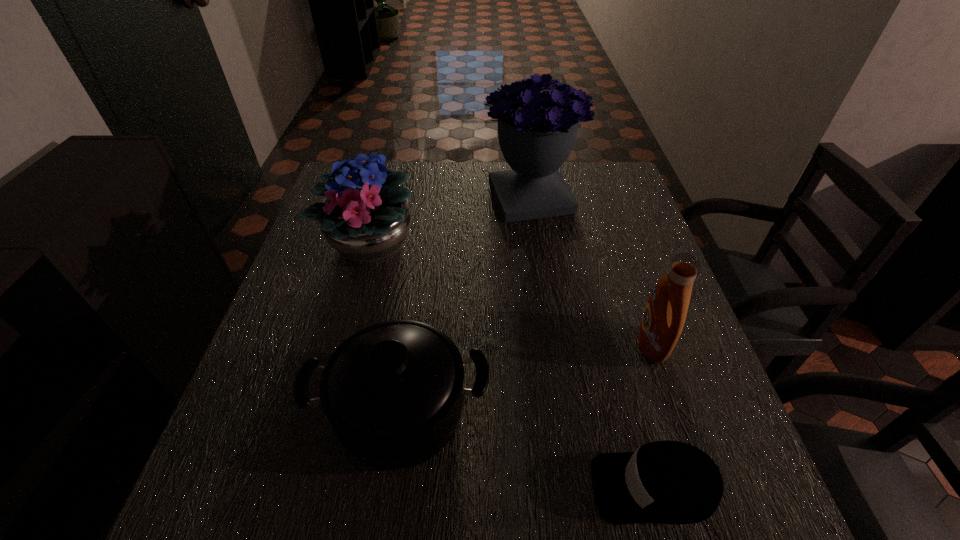
Identify which object is located as the fourth nearest to the detergent. Please provide its 2D coordinates. Your answer should be formatted as a tuple, i.e. [(x, y)], where the tuple contains the x and y coordinates of a point satisfying the conditions above.

[(365, 217)]

Identify which object is the closest to the detergent. Please provide its 2D coordinates. Your answer should be formatted as a tuple, i.e. [(x, y)], where the tuple contains the x and y coordinates of a point satisfying the conditions above.

[(667, 482)]